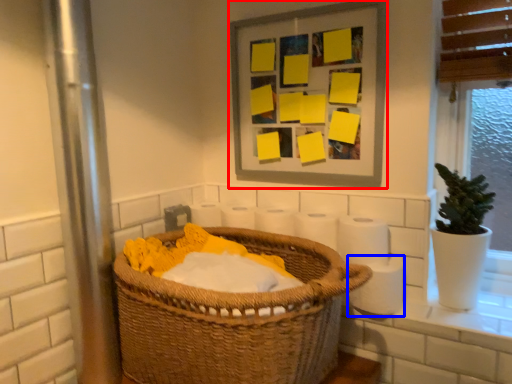
Question: Which of the following is the farthest to the observer, picture frame (highlighted by a red box) or toilet paper (highlighted by a blue box)?

Choices:
 (A) picture frame
 (B) toilet paper

Answer: (A)